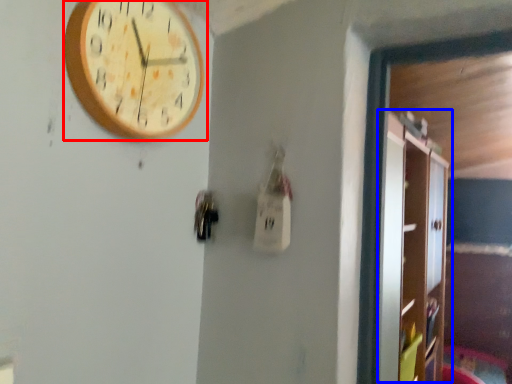
Question: Which of the following is the farthest to the observer, wall clock (highlighted by a red box) or dresser (highlighted by a blue box)?

Choices:
 (A) wall clock
 (B) dresser

Answer: (B)